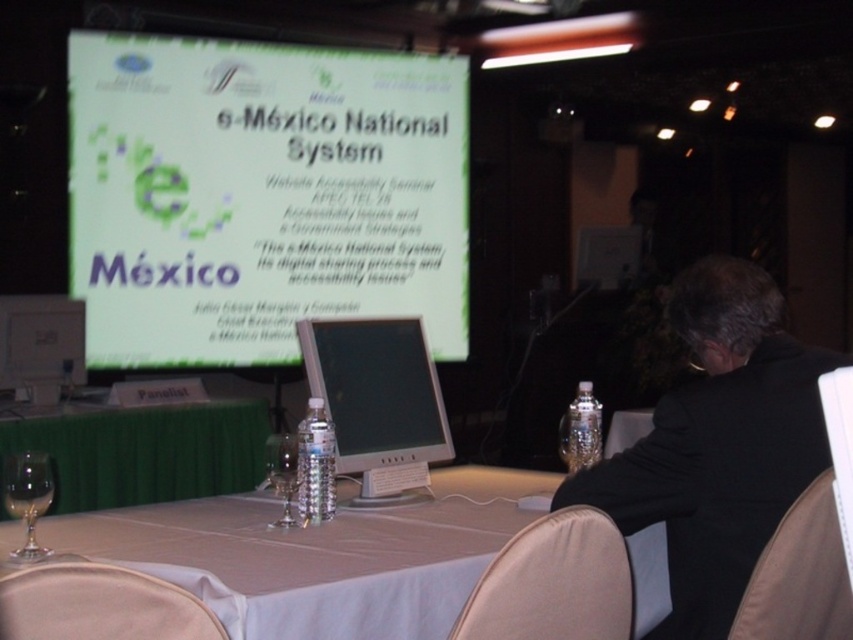
Question: Does white glossy projection screen at upper center appear on the right side of satin black monitor at center?

Choices:
 (A) no
 (B) yes

Answer: (A)

Question: Does beige fabric chair at lower center have a greater width compared to beige fabric chair at lower right?

Choices:
 (A) no
 (B) yes

Answer: (B)

Question: Among these objects, which one is nearest to the camera?

Choices:
 (A) white plastic table at center
 (B) satin black monitor at center

Answer: (B)

Question: Is satin black monitor at center below clear glass wine glass at center?

Choices:
 (A) yes
 (B) no

Answer: (B)

Question: Considering the real-world distances, which object is closest to the beige fabric chair at lower right?

Choices:
 (A) black suit at right
 (B) white glossy projection screen at upper center
 (C) beige fabric chair at lower left
 (D) satin black monitor at center

Answer: (A)

Question: Which of the following is the farthest from the observer?

Choices:
 (A) (291, 128)
 (B) (560, 634)
 (C) (22, 554)

Answer: (A)